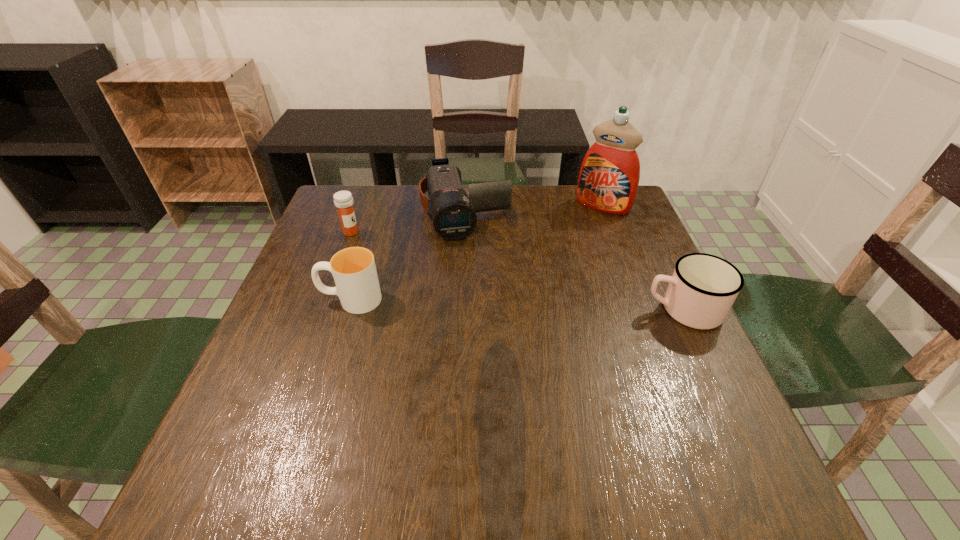
Find the location of a particular element. This screenshot has height=540, width=960. free space at the near edge is located at coordinates (631, 430).

The image size is (960, 540). In the image, there is a desktop. What are the coordinates of `vacant space at the far left corner` in the screenshot? It's located at (371, 190).

The height and width of the screenshot is (540, 960). In the image, there is a desktop. What are the coordinates of `vacant space at the far right corner` in the screenshot? It's located at (612, 220).

Locate an element on the screen. The width and height of the screenshot is (960, 540). blank space at the near right corner is located at coordinates (724, 414).

Locate an element on the screen. The width and height of the screenshot is (960, 540). empty space that is in between the mug and the third object from right to left is located at coordinates (574, 261).

This screenshot has height=540, width=960. What are the coordinates of `vacant region between the mug and the medicine` in the screenshot? It's located at (517, 271).

Find the location of a particular element. The width and height of the screenshot is (960, 540). empty location between the mug and the medicine is located at coordinates (517, 271).

Locate an element on the screen. The width and height of the screenshot is (960, 540). free space between the medicine and the third object from left to right is located at coordinates (408, 222).

Locate an element on the screen. free area in between the mug and the detergent is located at coordinates (643, 258).

Where is `free area in between the cup and the detergent`? The width and height of the screenshot is (960, 540). free area in between the cup and the detergent is located at coordinates (477, 253).